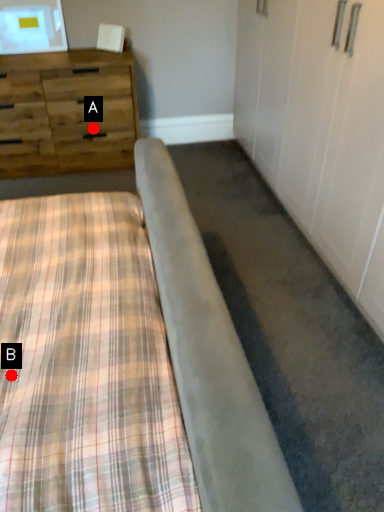
Question: Two points are circled on the image, labeled by A and B beside each circle. Among these points, which one is nearest to the camera?

Choices:
 (A) A is closer
 (B) B is closer

Answer: (B)